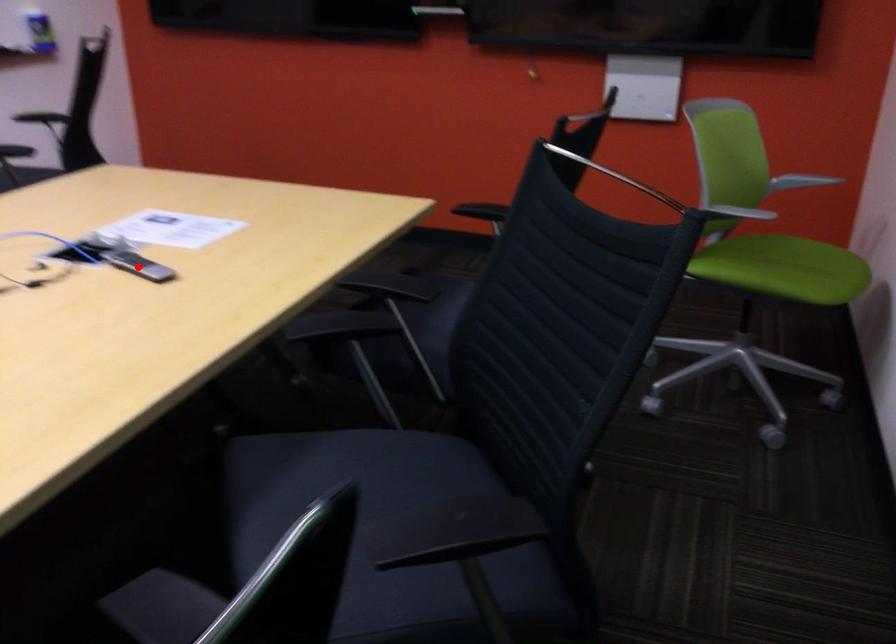
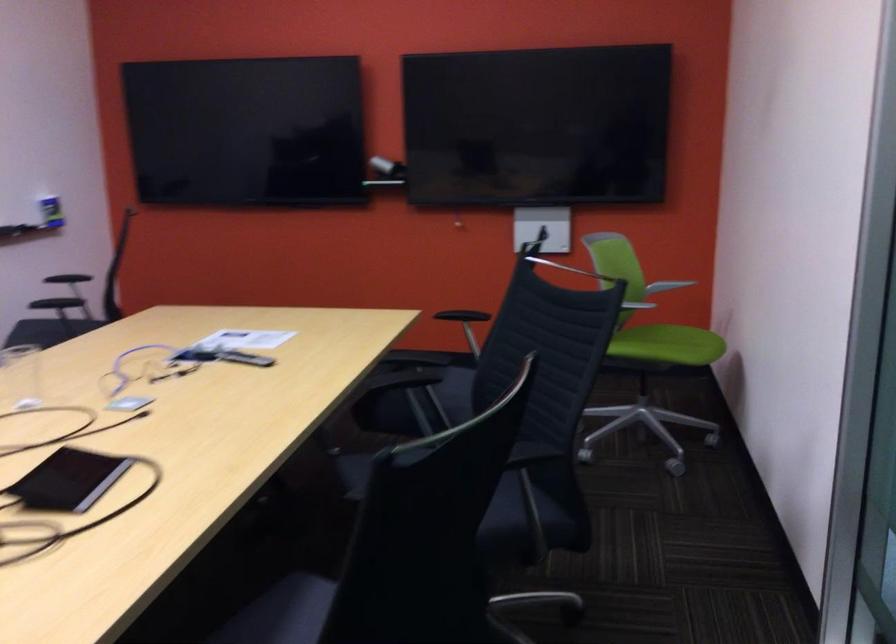
The point at the highlighted location is marked in the first image. Where is the corresponding point in the second image?

(244, 357)